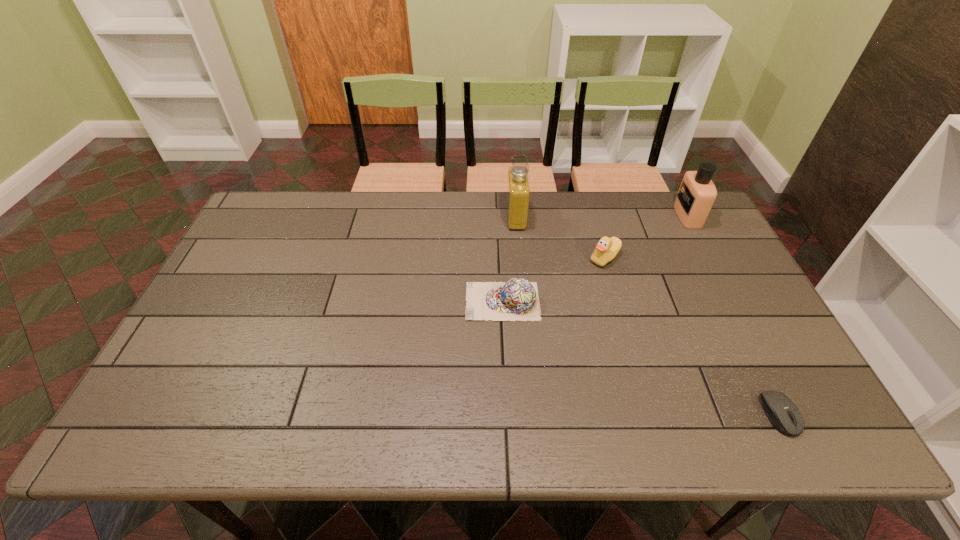
Locate an element on the screen. Image resolution: width=960 pixels, height=540 pixels. vacant area located on the left of the computer equipment is located at coordinates tap(593, 414).

Where is `object situated at the near edge`? object situated at the near edge is located at coordinates (781, 411).

Locate an element on the screen. Image resolution: width=960 pixels, height=540 pixels. perfume located in the right edge section of the desktop is located at coordinates (697, 193).

Find the location of a particular element. computer equipment located at the right edge is located at coordinates (781, 411).

The height and width of the screenshot is (540, 960). In order to click on object that is at the far right corner in this screenshot , I will do tap(697, 193).

Identify the location of object that is at the near right corner. (781, 411).

Where is `vacant space at the far edge of the desktop`? Image resolution: width=960 pixels, height=540 pixels. vacant space at the far edge of the desktop is located at coordinates (647, 203).

This screenshot has height=540, width=960. I want to click on vacant space at the near edge of the desktop, so click(x=534, y=409).

I want to click on vacant space at the right edge of the desktop, so click(x=743, y=344).

In the image, there is a desktop. What are the coordinates of `free space at the far left corner` in the screenshot? It's located at (276, 196).